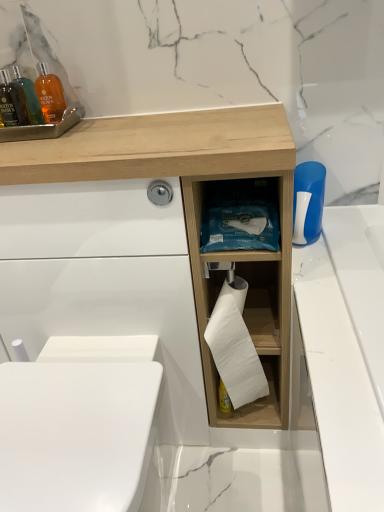
You are a GUI agent. You are given a task and a screenshot of the screen. Output one action in this format:
    pyautogui.click(x=<x>, y=<y>)
    Task: Click on the vacant area that lies in front of translucent amber bottle at upper left, the 2th mouthwash positioned from the back
    The image size is (384, 512).
    Given the screenshot: What is the action you would take?
    pyautogui.click(x=32, y=143)